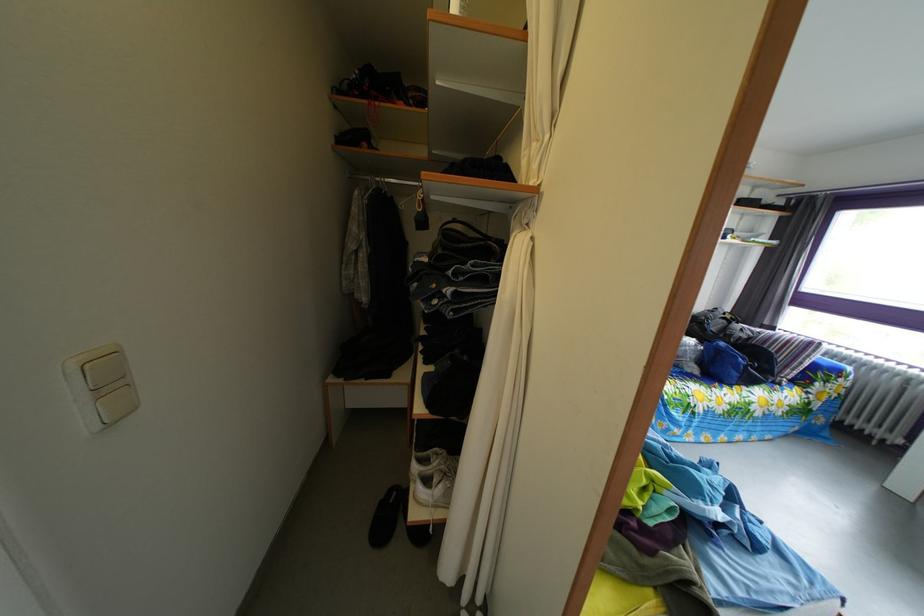
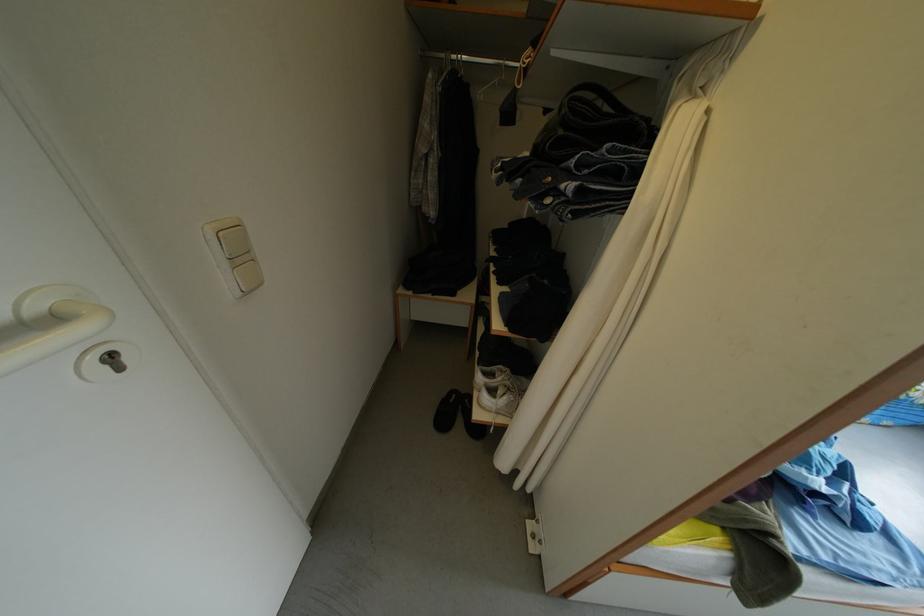
Find the pixel in the second image that matches pixel 438 490 in the first image.

(503, 400)